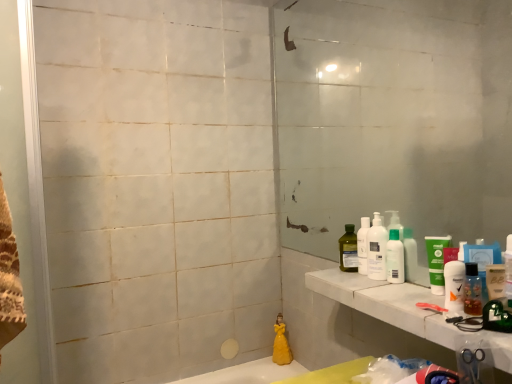
Question: In the image, is white plastic bottles at right, the first cleaning product from the front, positioned in front of or behind white plastic bottles at right?

Choices:
 (A) front
 (B) behind

Answer: (B)

Question: Based on their positions, is white plastic bottles at right, acting as the second cleaning product starting from the bottom, located to the left or right of white plastic bottles at right?

Choices:
 (A) left
 (B) right

Answer: (A)

Question: Estimate the real-world distances between objects in this image. Which object is farther from the white plastic bottles at right, marked as the second cleaning product in a back-to-front arrangement?

Choices:
 (A) transparent glass mirror at right
 (B) translucent plastic bottle at right, marked as the second mouthwash in a back-to-front arrangement
 (C) green matte tube at right, marked as the 2th mouthwash in a front-to-back arrangement
 (D) white plastic bottles at right
 (E) clear glass screen door at left

Answer: (E)

Question: Estimate the real-world distances between objects in this image. Which object is closer to the yellow matte figurine at lower center, which is counted as the 1th cleaning product, starting from the bottom?

Choices:
 (A) clear glass screen door at left
 (B) translucent plastic bottle at right, the 1th mouthwash viewed from the front
 (C) transparent glass mirror at right
 (D) white marble counter top at right
 (E) green matte tube at right, marked as the 2th mouthwash in a front-to-back arrangement

Answer: (D)